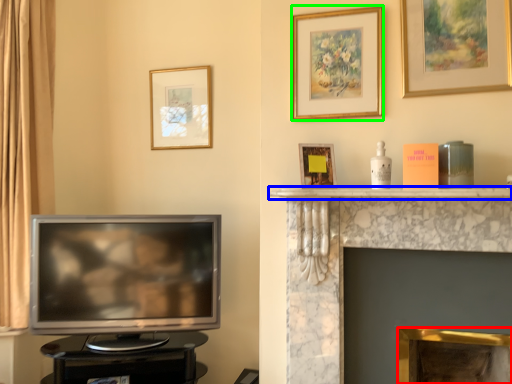
Question: Which is farther away from fireplace (highlighted by a red box)? mantle (highlighted by a blue box) or picture frame (highlighted by a green box)?

Choices:
 (A) mantle
 (B) picture frame

Answer: (B)